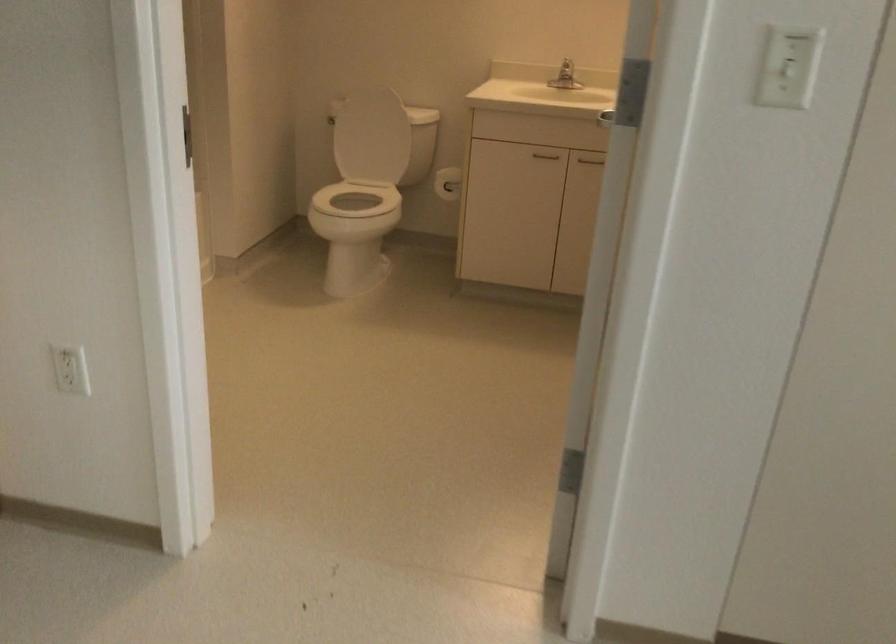
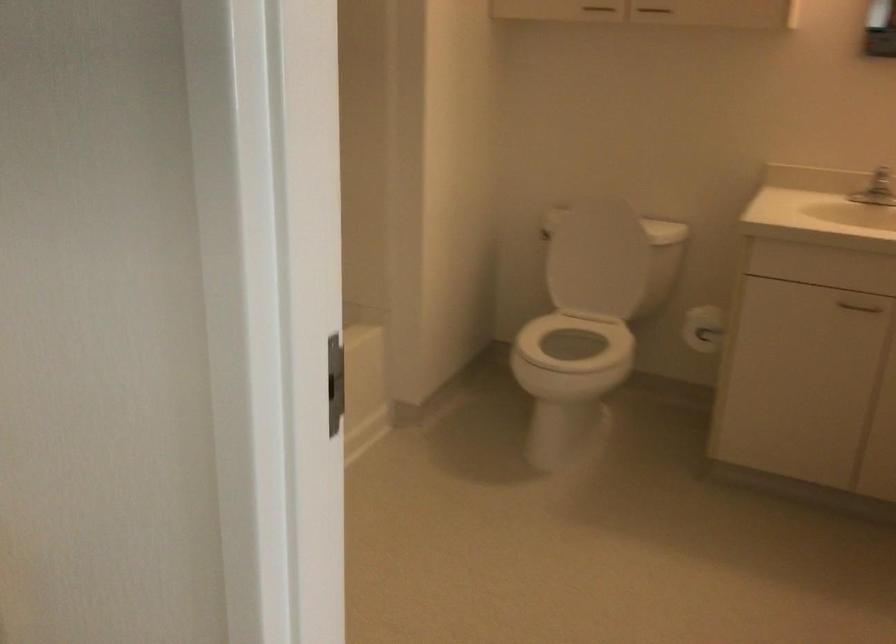
Question: What movement of the cameraman would produce the second image?

Choices:
 (A) Left
 (B) Right
 (C) Forward
 (D) Backward

Answer: (C)